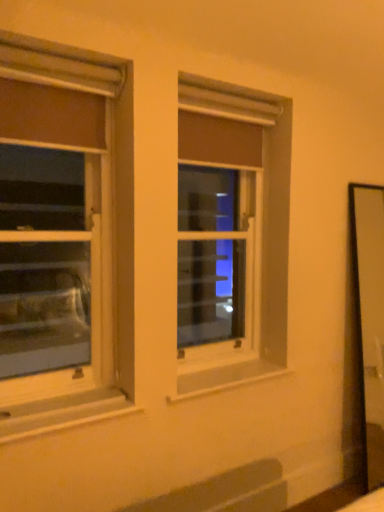
Question: Is clear glass window at center, which is the second window from front to back, positioned with its back to matte white window at left, which is the 1th window from left to right?

Choices:
 (A) no
 (B) yes

Answer: (A)

Question: Considering the relative positions of clear glass window at center, marked as the 1th window in a back-to-front arrangement, and matte white window at left, the 1th window from the front, in the image provided, is clear glass window at center, marked as the 1th window in a back-to-front arrangement, in front of matte white window at left, the 1th window from the front,?

Choices:
 (A) no
 (B) yes

Answer: (A)

Question: Is clear glass window at center, arranged as the second window when viewed from the left, oriented towards matte white window at left, marked as the 2th window in a right-to-left arrangement?

Choices:
 (A) yes
 (B) no

Answer: (B)

Question: Considering the relative sizes of clear glass window at center, marked as the 1th window in a back-to-front arrangement, and matte white window at left, the 1th window from the front, in the image provided, is clear glass window at center, marked as the 1th window in a back-to-front arrangement, thinner than matte white window at left, the 1th window from the front,?

Choices:
 (A) no
 (B) yes

Answer: (B)

Question: Is clear glass window at center, arranged as the second window when viewed from the left, further to camera compared to matte white window at left, which is the 2th window in back-to-front order?

Choices:
 (A) yes
 (B) no

Answer: (A)

Question: Is point (195, 335) positioned closer to the camera than point (99, 397)?

Choices:
 (A) farther
 (B) closer

Answer: (A)

Question: Would you say clear glass window at center, which is the second window from front to back, is to the left or to the right of white painted wood at lower left in the picture?

Choices:
 (A) left
 (B) right

Answer: (B)

Question: From a real-world perspective, is clear glass window at center, marked as the 1th window in a back-to-front arrangement, above or below white painted wood at lower left?

Choices:
 (A) below
 (B) above

Answer: (B)

Question: Is clear glass window at center, arranged as the second window when viewed from the left, bigger or smaller than white painted wood at lower left?

Choices:
 (A) big
 (B) small

Answer: (A)

Question: Is white painted wood at lower left wider or thinner than matte white window at left, which is the 2th window in back-to-front order?

Choices:
 (A) thin
 (B) wide

Answer: (B)

Question: From the image's perspective, is white painted wood at lower left above or below matte white window at left, marked as the 2th window in a right-to-left arrangement?

Choices:
 (A) below
 (B) above

Answer: (A)

Question: Considering the positions of white painted wood at lower left and matte white window at left, marked as the 2th window in a right-to-left arrangement, in the image, is white painted wood at lower left taller or shorter than matte white window at left, marked as the 2th window in a right-to-left arrangement,?

Choices:
 (A) tall
 (B) short

Answer: (B)

Question: In the image, is white painted wood at lower left positioned in front of or behind matte white window at left, which is the 2th window in back-to-front order?

Choices:
 (A) behind
 (B) front

Answer: (B)

Question: From a real-world perspective, is clear glass window at center, arranged as the second window when viewed from the left, physically located above or below matte white window at left, the 1th window from the front?

Choices:
 (A) below
 (B) above

Answer: (A)

Question: From the image's perspective, relative to matte white window at left, which is the 1th window from left to right, is clear glass window at center, arranged as the second window when viewed from the left, above or below?

Choices:
 (A) above
 (B) below

Answer: (A)